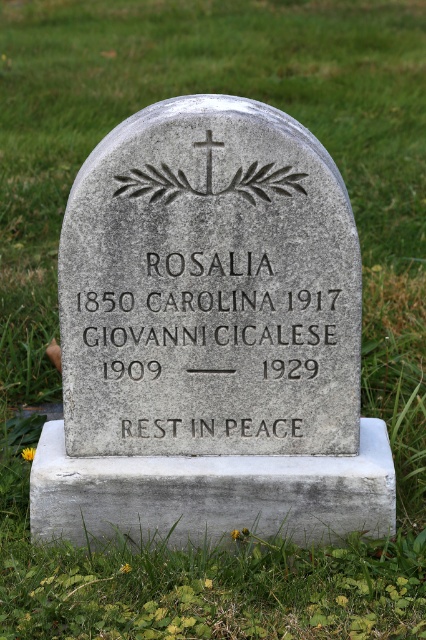
Question: Can you confirm if gray stone gravestone at center is positioned to the left of gray stone cross at center?

Choices:
 (A) yes
 (B) no

Answer: (B)

Question: Among these objects, which one is farthest from the camera?

Choices:
 (A) gray stone gravestone at center
 (B) gray stone cross at center

Answer: (B)

Question: Is the position of gray stone gravestone at center less distant than that of gray stone cross at center?

Choices:
 (A) no
 (B) yes

Answer: (B)

Question: Which object is closer to the camera taking this photo?

Choices:
 (A) gray stone cross at center
 (B) gray stone gravestone at center

Answer: (B)

Question: Is gray stone gravestone at center bigger than gray stone cross at center?

Choices:
 (A) no
 (B) yes

Answer: (B)